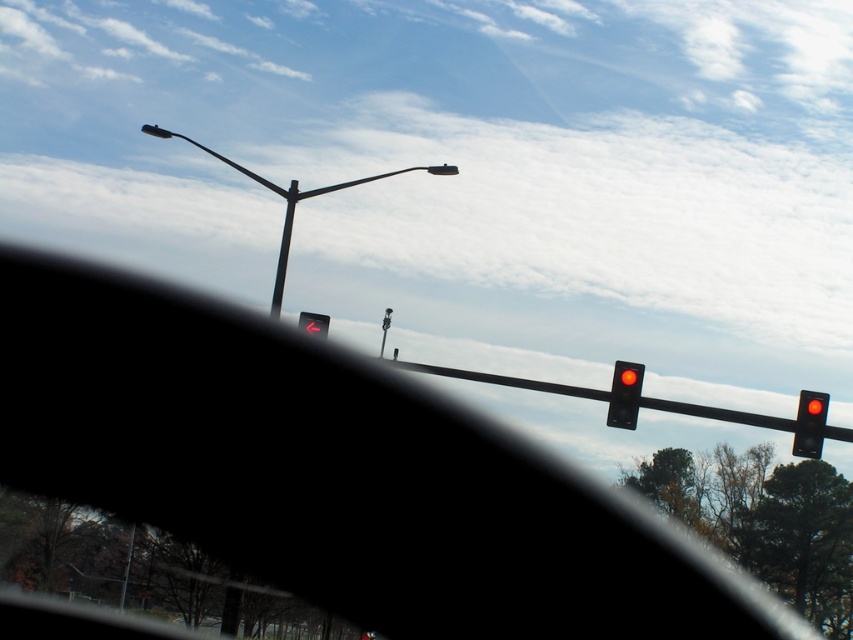
You are driving a car and see the metallic pole at center and the red matte traffic light at center. Which object is positioned higher in the scene?

The metallic pole at center is located above the red matte traffic light at center, so it is positioned higher in the scene.

You are a driver approaching an intersection. You see the matte glass traffic light at center right and the red matte traffic light at center. Which traffic light is taller?

The matte glass traffic light at center right is taller than the red matte traffic light at center.